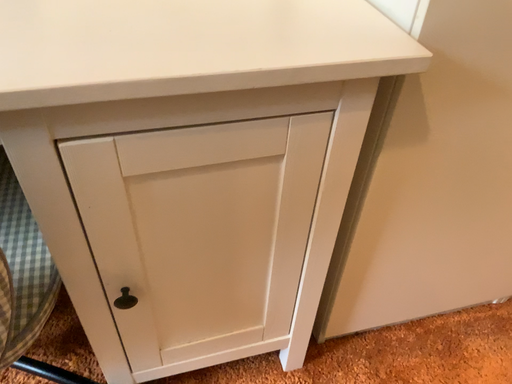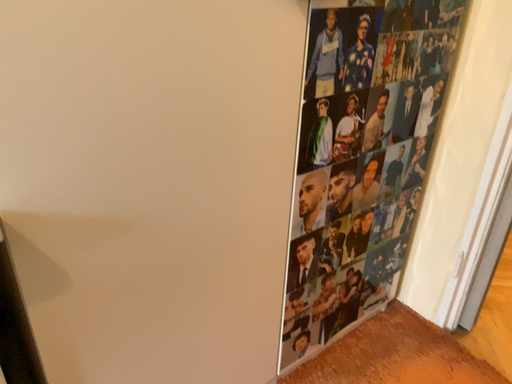
Question: How did the camera likely rotate when shooting the video?

Choices:
 (A) rotated upward
 (B) rotated downward

Answer: (A)